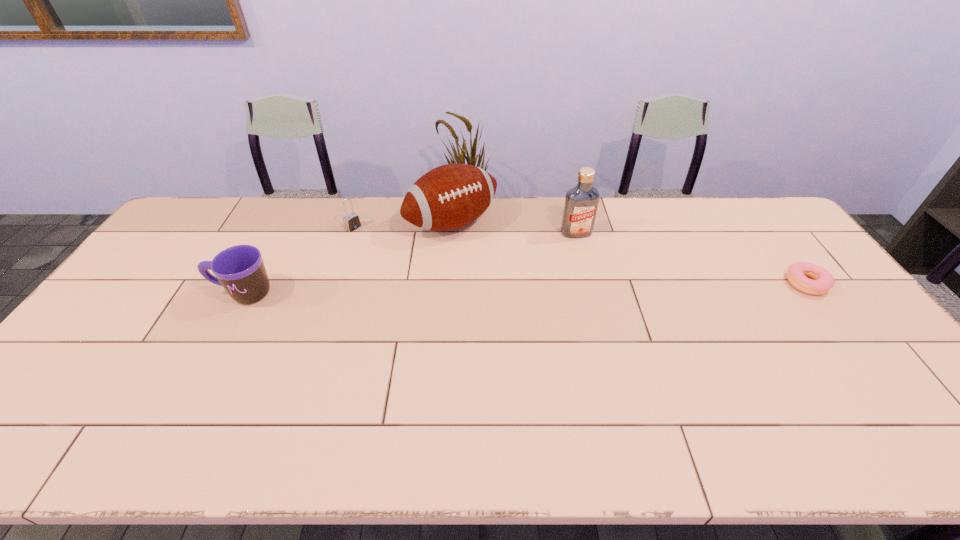
This screenshot has height=540, width=960. I want to click on vacant space on the desktop that is between the leftmost object and the doughnut and is positioned on the laces of the football, so click(515, 289).

The height and width of the screenshot is (540, 960). Find the location of `free space on the desktop that is between the mug and the doughnut and is positioned on the front-facing side of the second object from right to left`. free space on the desktop that is between the mug and the doughnut and is positioned on the front-facing side of the second object from right to left is located at coordinates point(600,287).

The width and height of the screenshot is (960, 540). Find the location of `free space on the desktop that is between the mug and the shortest object and is positioned on the shackle of the fourth object from right to left`. free space on the desktop that is between the mug and the shortest object and is positioned on the shackle of the fourth object from right to left is located at coordinates (446, 290).